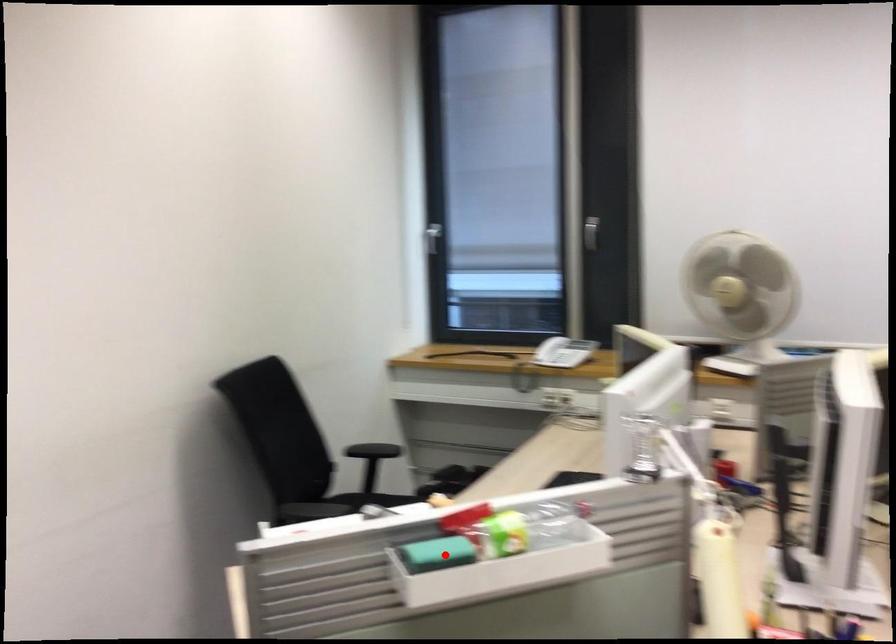
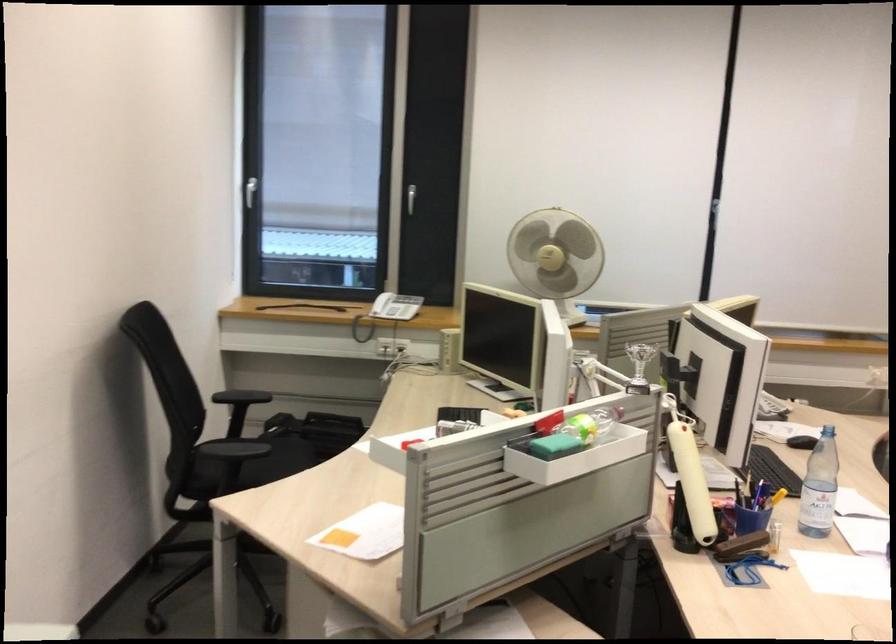
Question: I am providing you with two images of the same scene from different viewpoints. In image1, a red point is highlighted. Considering the same 3D point in image2, which of the following is correct?

Choices:
 (A) It is closer
 (B) It is farther

Answer: (B)